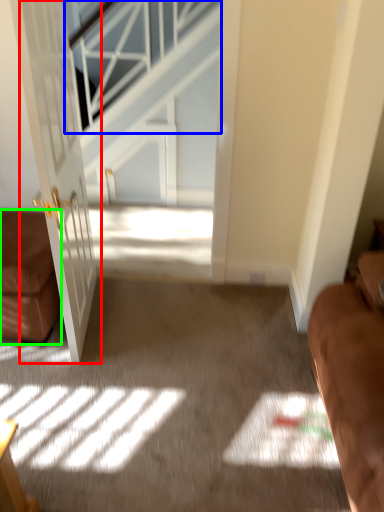
Question: Estimate the real-world distances between objects in this image. Which object is farther from door (highlighted by a red box), window (highlighted by a blue box) or furniture (highlighted by a green box)?

Choices:
 (A) window
 (B) furniture

Answer: (A)